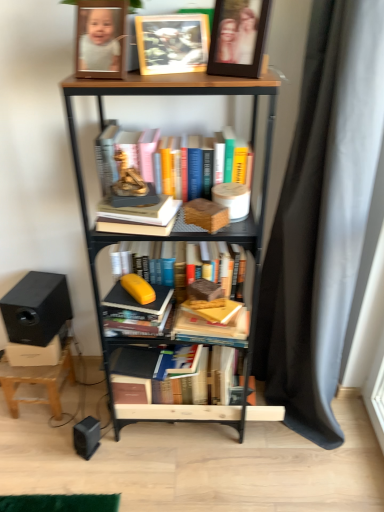
Question: From a real-world perspective, is wooden bookcase at center located beneath hardcover book at center, acting as the 2th book starting from the top?

Choices:
 (A) no
 (B) yes

Answer: (B)

Question: Does wooden bookcase at center lie behind hardcover book at center, the 3th book ordered from the bottom?

Choices:
 (A) no
 (B) yes

Answer: (A)

Question: Can you confirm if wooden bookcase at center is bigger than hardcover book at center, acting as the 2th book starting from the top?

Choices:
 (A) yes
 (B) no

Answer: (A)

Question: Considering the relative positions of wooden bookcase at center and hardcover book at center, the 3th book ordered from the bottom, in the image provided, is wooden bookcase at center to the right of hardcover book at center, the 3th book ordered from the bottom, from the viewer's perspective?

Choices:
 (A) yes
 (B) no

Answer: (A)

Question: Could you tell me if wooden bookcase at center is turned towards hardcover book at center, acting as the 2th book starting from the top?

Choices:
 (A) yes
 (B) no

Answer: (A)

Question: In terms of size, does wooden statue at center appear bigger or smaller than wooden picture frame at upper center, acting as the first picture frame starting from the right?

Choices:
 (A) small
 (B) big

Answer: (A)

Question: Do you think wooden statue at center is within wooden picture frame at upper center, arranged as the 2th picture frame when viewed from the left, or outside of it?

Choices:
 (A) inside
 (B) outside

Answer: (B)

Question: Is wooden statue at center to the left or to the right of wooden picture frame at upper center, acting as the first picture frame starting from the right, in the image?

Choices:
 (A) left
 (B) right

Answer: (A)

Question: From their relative heights in the image, would you say wooden statue at center is taller or shorter than wooden picture frame at upper center, acting as the first picture frame starting from the right?

Choices:
 (A) short
 (B) tall

Answer: (A)

Question: Is hardcover book at center, the 4th book from the top, to the left or to the right of wooden stool at lower left in the image?

Choices:
 (A) left
 (B) right

Answer: (B)

Question: Considering the positions of hardcover book at center, which ranks as the first book in bottom-to-top order, and wooden stool at lower left in the image, is hardcover book at center, which ranks as the first book in bottom-to-top order, wider or thinner than wooden stool at lower left?

Choices:
 (A) thin
 (B) wide

Answer: (A)

Question: In the image, is hardcover book at center, the 4th book from the top, positioned in front of or behind wooden stool at lower left?

Choices:
 (A) behind
 (B) front

Answer: (B)

Question: From their relative heights in the image, would you say hardcover book at center, which ranks as the first book in bottom-to-top order, is taller or shorter than wooden stool at lower left?

Choices:
 (A) tall
 (B) short

Answer: (B)

Question: Considering the positions of point (x=127, y=194) and point (x=203, y=311), is point (x=127, y=194) closer or farther from the camera than point (x=203, y=311)?

Choices:
 (A) closer
 (B) farther

Answer: (A)

Question: From their relative heights in the image, would you say wooden statue at center is taller or shorter than hardcover book at center, the 4th book from the top?

Choices:
 (A) short
 (B) tall

Answer: (A)